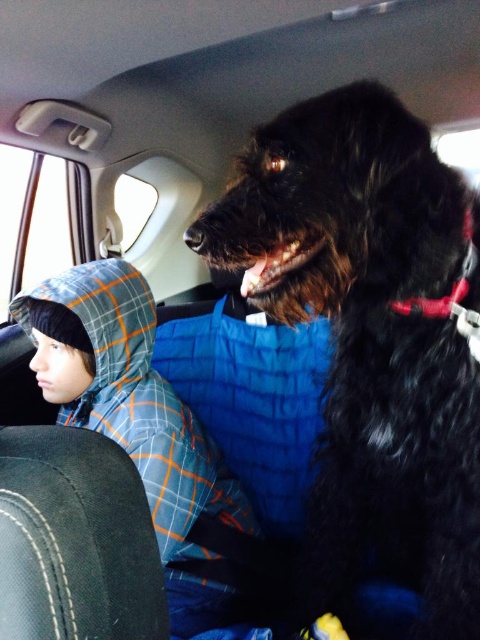
You are a car seat designer and need to ensure that the black shaggy dog at upper right and the blue plaid jacket at center can both fit comfortably in the backseat. Based on their sizes, which one requires more vertical space?

The black shaggy dog at upper right requires more vertical space because it is much taller than the blue plaid jacket at center.

You are a car seat designer checking the space between the black shaggy dog at upper right and the blue plaid jacket at center. Can the dog fit comfortably next to the jacket without any tightness?

The black shaggy dog at upper right is narrower than the blue plaid jacket at center, so it can fit comfortably next to the jacket without any tightness.

You are sitting in the front passenger seat of the car and want to reach both the point at coordinates [389,522] and the point at [222,611]. Which point will you reach first if you extend your arm?

The point at coordinates [389,522] is closer to the viewer than the point at [222,611], so you will reach the point at [389,522] first.